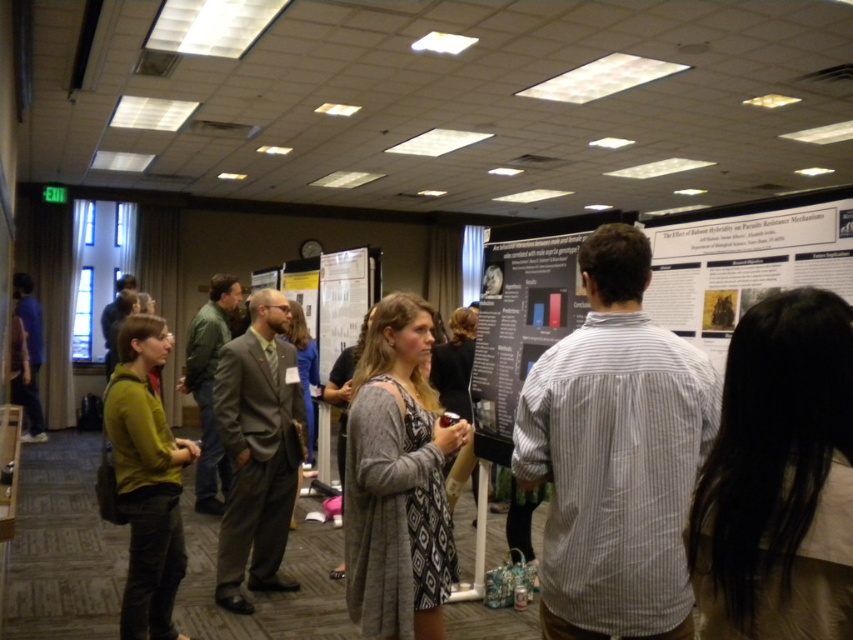
You are organizing a photo shoot and need to ensure that the black hair at upper right and the matte green sweater at left are both visible in the frame. Based on their sizes, which object should you prioritize positioning closer to the camera to ensure visibility?

The black hair at upper right should be positioned closer to the camera since it occupies less space than the matte green sweater at left, making it smaller and potentially harder to see from a distance.

The black hair at upper right is located at point (x=779, y=477). Is this point within the bounds of the image?

Yes, the point (x=779, y=477) is within the image as it corresponds to the location of the black hair at upper right.